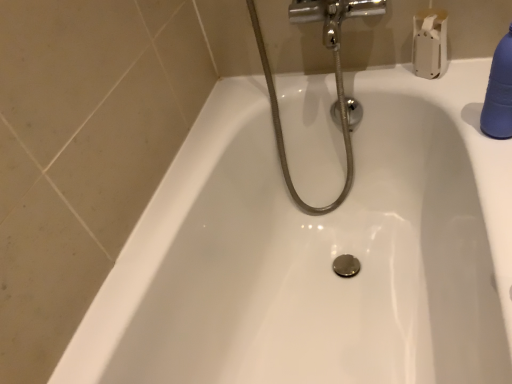
Question: Does blue rubber bottle at upper right have a smaller size compared to chrome metallic showerhead at upper center?

Choices:
 (A) yes
 (B) no

Answer: (A)

Question: Does blue rubber bottle at upper right come in front of chrome metallic showerhead at upper center?

Choices:
 (A) yes
 (B) no

Answer: (A)

Question: Are blue rubber bottle at upper right and chrome metallic showerhead at upper center far apart?

Choices:
 (A) no
 (B) yes

Answer: (A)

Question: From a real-world perspective, is blue rubber bottle at upper right beneath chrome metallic showerhead at upper center?

Choices:
 (A) yes
 (B) no

Answer: (B)

Question: Is blue rubber bottle at upper right turned away from chrome metallic showerhead at upper center?

Choices:
 (A) yes
 (B) no

Answer: (B)

Question: Does blue rubber bottle at upper right have a greater height compared to chrome metallic showerhead at upper center?

Choices:
 (A) no
 (B) yes

Answer: (A)

Question: From the image's perspective, is chrome metallic showerhead at upper center on white matte toilet paper at upper right?

Choices:
 (A) no
 (B) yes

Answer: (A)

Question: Is chrome metallic showerhead at upper center positioned behind white matte toilet paper at upper right?

Choices:
 (A) no
 (B) yes

Answer: (A)

Question: Can you confirm if chrome metallic showerhead at upper center is smaller than white matte toilet paper at upper right?

Choices:
 (A) no
 (B) yes

Answer: (A)

Question: Considering the relative sizes of chrome metallic showerhead at upper center and white matte toilet paper at upper right in the image provided, is chrome metallic showerhead at upper center taller than white matte toilet paper at upper right?

Choices:
 (A) yes
 (B) no

Answer: (A)

Question: Is chrome metallic showerhead at upper center located outside white matte toilet paper at upper right?

Choices:
 (A) yes
 (B) no

Answer: (A)

Question: Can you confirm if chrome metallic showerhead at upper center is thinner than white matte toilet paper at upper right?

Choices:
 (A) no
 (B) yes

Answer: (A)

Question: Is chrome metallic showerhead at upper center facing towards blue rubber bottle at upper right?

Choices:
 (A) no
 (B) yes

Answer: (A)